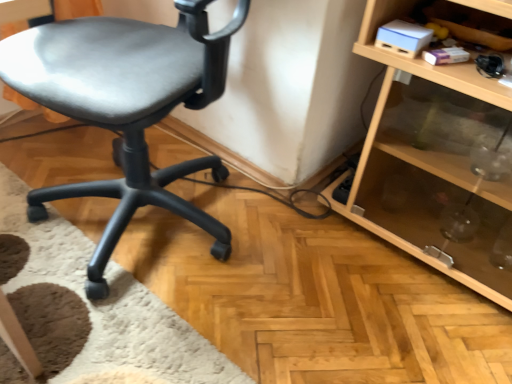
In order to face matte black chair at left, should I rotate leftwards or rightwards?

To align with it, rotate left about 16.149°.

The image size is (512, 384). What do you see at coordinates (126, 105) in the screenshot? I see `matte black chair at left` at bounding box center [126, 105].

Where is `matte black chair at left`? The image size is (512, 384). matte black chair at left is located at coordinates (126, 105).

Describe the element at coordinates (434, 164) in the screenshot. This screenshot has width=512, height=384. I see `transparent glass shelf at lower right` at that location.

At what (x,y) coordinates should I click in order to perform the action: click on transparent glass shelf at lower right. Please return your answer as a coordinate pair (x, y). Looking at the image, I should click on (434, 164).

Find the location of a particular element. This screenshot has width=512, height=384. matte black chair at left is located at coordinates tap(126, 105).

Can you confirm if matte black chair at left is positioned to the left of transparent glass shelf at lower right?

Yes.

Is the position of matte black chair at left less distant than that of transparent glass shelf at lower right?

Yes, the depth of matte black chair at left is less than that of transparent glass shelf at lower right.

Is point (86, 293) closer or farther from the camera than point (373, 24)?

Point (86, 293) is farther from the camera than point (373, 24).

From the image's perspective, is matte black chair at left located beneath transparent glass shelf at lower right?

Actually, matte black chair at left appears above transparent glass shelf at lower right in the image.

From a real-world perspective, does matte black chair at left sit lower than transparent glass shelf at lower right?

Actually, matte black chair at left is physically above transparent glass shelf at lower right in the real world.

Which object is wider, matte black chair at left or transparent glass shelf at lower right?

With larger width is matte black chair at left.

Can you confirm if matte black chair at left is shorter than transparent glass shelf at lower right?

No, matte black chair at left is not shorter than transparent glass shelf at lower right.

Which of these two, matte black chair at left or transparent glass shelf at lower right, is smaller?

With smaller size is transparent glass shelf at lower right.

Would you say matte black chair at left contains transparent glass shelf at lower right?

No, matte black chair at left does not contain transparent glass shelf at lower right.

Are matte black chair at left and transparent glass shelf at lower right making contact?

matte black chair at left is not next to transparent glass shelf at lower right, and they're not touching.

Could you tell me if matte black chair at left is facing transparent glass shelf at lower right?

No.

How different are the orientations of matte black chair at left and transparent glass shelf at lower right in degrees?

matte black chair at left and transparent glass shelf at lower right are facing 8.62 degrees away from each other.

You are a GUI agent. You are given a task and a screenshot of the screen. Output one action in this format:
    pyautogui.click(x=<x>, y=<y>)
    Task: Click on the shelf that appears below the matte black chair at left (from the image's perspective)
    This screenshot has height=384, width=512.
    Given the screenshot: What is the action you would take?
    coord(434,164)

Is transparent glass shelf at lower right at the left side of matte black chair at left?

No, transparent glass shelf at lower right is not to the left of matte black chair at left.

Is the position of transparent glass shelf at lower right less distant than that of matte black chair at left?

No, transparent glass shelf at lower right is behind matte black chair at left.

Considering the positions of points (501, 282) and (227, 56), is point (501, 282) farther from camera compared to point (227, 56)?

Yes, point (501, 282) is farther from viewer.

From the image's perspective, which one is positioned lower, transparent glass shelf at lower right or matte black chair at left?

transparent glass shelf at lower right appears lower in the image.

From a real-world perspective, who is located higher, transparent glass shelf at lower right or matte black chair at left?

From a 3D spatial view, matte black chair at left is above.

Looking at their sizes, would you say transparent glass shelf at lower right is wider or thinner than matte black chair at left?

Clearly, transparent glass shelf at lower right has less width compared to matte black chair at left.

Who is taller, transparent glass shelf at lower right or matte black chair at left?

matte black chair at left is taller.

Is transparent glass shelf at lower right bigger than matte black chair at left?

Actually, transparent glass shelf at lower right might be smaller than matte black chair at left.

Is matte black chair at left located within transparent glass shelf at lower right?

No, matte black chair at left is not surrounded by transparent glass shelf at lower right.

Consider the image. Would you say transparent glass shelf at lower right is a long distance from matte black chair at left?

No, transparent glass shelf at lower right is in close proximity to matte black chair at left.

Could you tell me if transparent glass shelf at lower right is turned towards matte black chair at left?

No, transparent glass shelf at lower right is not facing towards matte black chair at left.

How many degrees apart are the facing directions of transparent glass shelf at lower right and matte black chair at left?

The facing directions of transparent glass shelf at lower right and matte black chair at left are 8.62 degrees apart.

The width and height of the screenshot is (512, 384). What are the coordinates of `chair above the transparent glass shelf at lower right (from the image's perspective)` in the screenshot? It's located at (126, 105).

I want to click on chair on the left of transparent glass shelf at lower right, so click(x=126, y=105).

The height and width of the screenshot is (384, 512). I want to click on shelf lying below the matte black chair at left (from the image's perspective), so pyautogui.click(x=434, y=164).